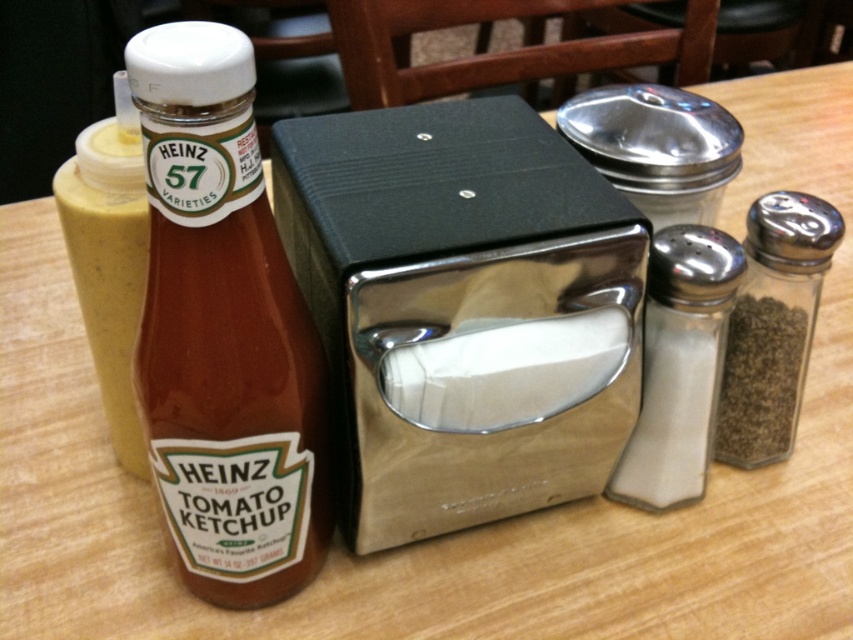
Question: Is white glass salt shaker at right thinner than clear glass salt shaker at right?

Choices:
 (A) no
 (B) yes

Answer: (B)

Question: Can you confirm if matte glass bottle at left is positioned below clear glass salt shaker at right?

Choices:
 (A) yes
 (B) no

Answer: (A)

Question: Which point is farther to the camera?

Choices:
 (A) matte glass bottle at left
 (B) clear glass salt shaker at right

Answer: (B)

Question: Among these objects, which one is nearest to the camera?

Choices:
 (A) clear glass salt shaker at right
 (B) matte glass bottle at left
 (C) white glass salt shaker at right

Answer: (B)

Question: Can you confirm if matte glass bottle at left is thinner than clear glass salt shaker at right?

Choices:
 (A) no
 (B) yes

Answer: (A)

Question: Which point is closer to the camera taking this photo?

Choices:
 (A) (689, 426)
 (B) (204, 552)
 (C) (786, 301)

Answer: (B)